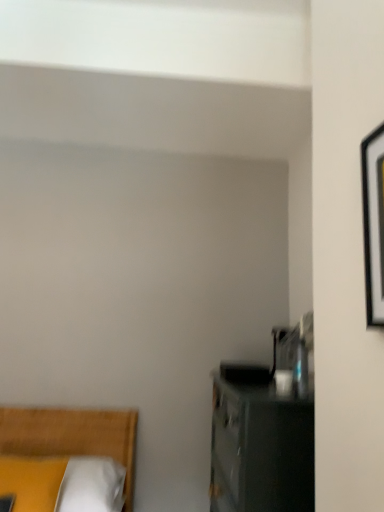
I want to click on black matte picture frame at right, so click(373, 223).

The image size is (384, 512). I want to click on yellow fabric bed at lower left, so click(x=72, y=435).

From a real-world perspective, is yellow fabric bed at lower left positioned under black matte picture frame at right based on gravity?

Yes.

How many degrees apart are the facing directions of yellow fabric bed at lower left and black matte picture frame at right?

They differ by 86 degrees in their facing directions.

Which point is more distant from viewer, (6, 414) or (365, 248)?

The point (6, 414) is more distant.

Where is `picture frame above the yellow fabric bed at lower left (from the image's perspective)`? The image size is (384, 512). picture frame above the yellow fabric bed at lower left (from the image's perspective) is located at coordinates (373, 223).

This screenshot has width=384, height=512. Identify the location of picture frame that is in front of the yellow fabric bed at lower left. (373, 223).

Is black matte picture frame at right touching yellow fabric bed at lower left?

No.

Between point (368, 315) and point (9, 423), which one is positioned behind?

The point (9, 423) is farther.

Which object is closer to the camera, yellow fabric bed at lower left or yellow fabric pillow at lower left?

Positioned in front is yellow fabric pillow at lower left.

Which is correct: yellow fabric bed at lower left is inside yellow fabric pillow at lower left, or outside of it?

yellow fabric bed at lower left is spatially situated outside yellow fabric pillow at lower left.

Is yellow fabric bed at lower left positioned with its back to yellow fabric pillow at lower left?

Yes, yellow fabric bed at lower left is facing away from yellow fabric pillow at lower left.

From the image's perspective, is yellow fabric bed at lower left positioned above or below yellow fabric pillow at lower left?

Based on their image positions, yellow fabric bed at lower left is located beneath yellow fabric pillow at lower left.

Considering the points (22, 466) and (380, 234), which point is behind, point (22, 466) or point (380, 234)?

The point (22, 466) is behind.

Can you tell me how much yellow fabric pillow at lower left and black matte picture frame at right differ in facing direction?

There is a 66.5-degree angle between the facing directions of yellow fabric pillow at lower left and black matte picture frame at right.

Based on their sizes in the image, would you say yellow fabric pillow at lower left is bigger or smaller than black matte picture frame at right?

Clearly, yellow fabric pillow at lower left is larger in size than black matte picture frame at right.

Considering the relative sizes of yellow fabric pillow at lower left and black matte picture frame at right in the image provided, is yellow fabric pillow at lower left wider than black matte picture frame at right?

Correct, the width of yellow fabric pillow at lower left exceeds that of black matte picture frame at right.

Can you confirm if yellow fabric pillow at lower left is smaller than yellow fabric bed at lower left?

Indeed, yellow fabric pillow at lower left has a smaller size compared to yellow fabric bed at lower left.

Looking at their sizes, would you say yellow fabric pillow at lower left is wider or thinner than yellow fabric bed at lower left?

yellow fabric pillow at lower left is thinner than yellow fabric bed at lower left.

In terms of height, does yellow fabric pillow at lower left look taller or shorter compared to yellow fabric bed at lower left?

In the image, yellow fabric pillow at lower left appears to be shorter than yellow fabric bed at lower left.

From a real-world perspective, is yellow fabric pillow at lower left located beneath yellow fabric bed at lower left?

Incorrect, from a real-world perspective, yellow fabric pillow at lower left is higher than yellow fabric bed at lower left.

Locate an element on the screen. pillow behind the black matte picture frame at right is located at coordinates point(32,482).

In terms of width, does black matte picture frame at right look wider or thinner when compared to yellow fabric pillow at lower left?

black matte picture frame at right is thinner than yellow fabric pillow at lower left.

Is point (376, 256) behind point (2, 495)?

No, it is not.

From the picture: Does black matte picture frame at right touch yellow fabric pillow at lower left?

black matte picture frame at right and yellow fabric pillow at lower left are clearly separated.

Locate an element on the screen. picture frame located above the yellow fabric bed at lower left (from the image's perspective) is located at coordinates (373, 223).

What are the coordinates of `picture frame on the right side of yellow fabric bed at lower left` in the screenshot? It's located at (373, 223).

Based on their spatial positions, is yellow fabric bed at lower left or yellow fabric pillow at lower left closer to black matte picture frame at right?

yellow fabric pillow at lower left is closer to black matte picture frame at right.

Considering their positions, is black matte picture frame at right positioned further to yellow fabric pillow at lower left than yellow fabric bed at lower left?

The object further to yellow fabric pillow at lower left is black matte picture frame at right.

Based on their spatial positions, is yellow fabric pillow at lower left or black matte picture frame at right further from yellow fabric bed at lower left?

black matte picture frame at right.

Looking at this image, estimate the real-world distances between objects in this image. Which object is closer to black matte picture frame at right, yellow fabric pillow at lower left or yellow fabric bed at lower left?

yellow fabric pillow at lower left.

From the image, which object appears to be farther from yellow fabric pillow at lower left, yellow fabric bed at lower left or black matte picture frame at right?

black matte picture frame at right is further to yellow fabric pillow at lower left.

Looking at the image, which one is located closer to yellow fabric bed at lower left, black matte picture frame at right or yellow fabric pillow at lower left?

yellow fabric pillow at lower left lies closer to yellow fabric bed at lower left than the other object.

Where is `pillow between black matte picture frame at right and yellow fabric bed at lower left vertically`? This screenshot has width=384, height=512. pillow between black matte picture frame at right and yellow fabric bed at lower left vertically is located at coordinates (32, 482).